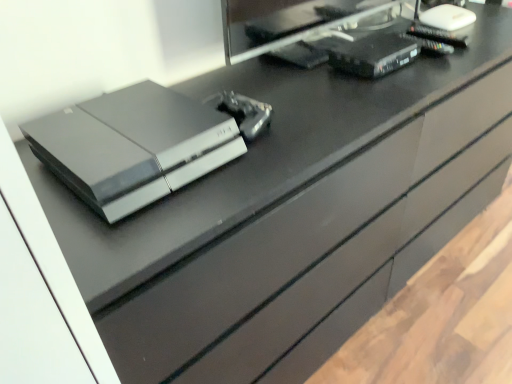
This screenshot has height=384, width=512. I want to click on free spot in front of black plastic router at upper right, positioned as the 1th equipment in back-to-front order, so click(382, 90).